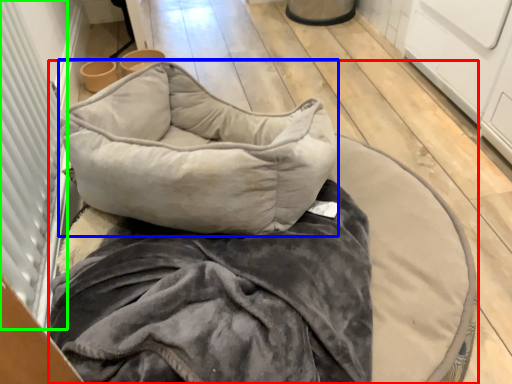
Question: Which object is positioned farthest from furniture (highlighted by a red box)? Select from pillow (highlighted by a blue box) and screen door (highlighted by a green box).

Choices:
 (A) pillow
 (B) screen door

Answer: (B)